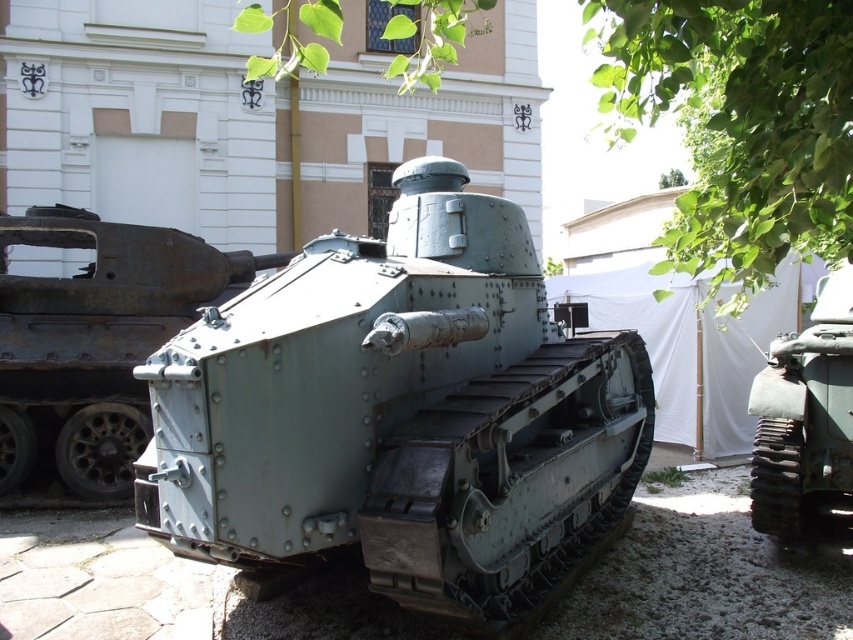
Question: Observing the image, what is the correct spatial positioning of matte green tank at center in reference to rusty metal tank at center?

Choices:
 (A) right
 (B) left

Answer: (A)

Question: Can you confirm if rusty metal tank at center is smaller than green matte tank at right?

Choices:
 (A) yes
 (B) no

Answer: (B)

Question: Which object appears closest to the camera in this image?

Choices:
 (A) green leafy tree at upper center
 (B) green matte tank at right
 (C) rusty metal tank at center

Answer: (A)

Question: Which of the following is the farthest from the observer?

Choices:
 (A) matte green tank at center
 (B) rusty metal tank at center
 (C) green matte tank at right

Answer: (B)

Question: Which point is closer to the camera taking this photo?

Choices:
 (A) (711, 33)
 (B) (212, 561)
 (C) (16, 340)

Answer: (A)

Question: Does matte green tank at center appear under green matte tank at right?

Choices:
 (A) no
 (B) yes

Answer: (B)